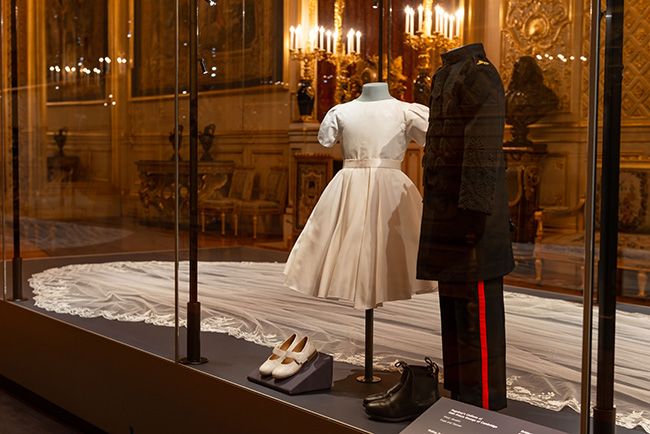
I want to click on candleabra, so click(305, 54), click(338, 55), click(424, 44).